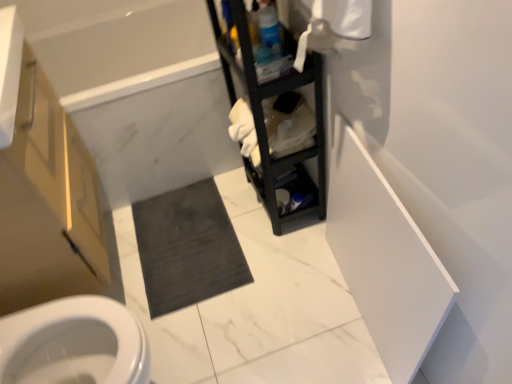
Question: Considering the positions of white marble bathtub at upper left and dark gray carpet at center in the image, is white marble bathtub at upper left taller or shorter than dark gray carpet at center?

Choices:
 (A) tall
 (B) short

Answer: (A)

Question: Is white marble bathtub at upper left inside or outside of dark gray carpet at center?

Choices:
 (A) inside
 (B) outside

Answer: (B)

Question: Which object is the closest to the matte wood cabinet at left?

Choices:
 (A) white marble bathtub at upper left
 (B) black matte shelf at center
 (C) dark gray carpet at center

Answer: (A)

Question: Which object is the farthest from the black matte shelf at center?

Choices:
 (A) white marble bathtub at upper left
 (B) dark gray carpet at center
 (C) matte wood cabinet at left

Answer: (C)